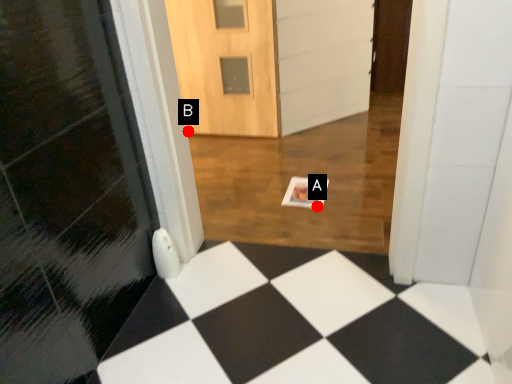
Question: Two points are circled on the image, labeled by A and B beside each circle. Which point is farther from the camera taking this photo?

Choices:
 (A) A is further
 (B) B is further

Answer: (B)